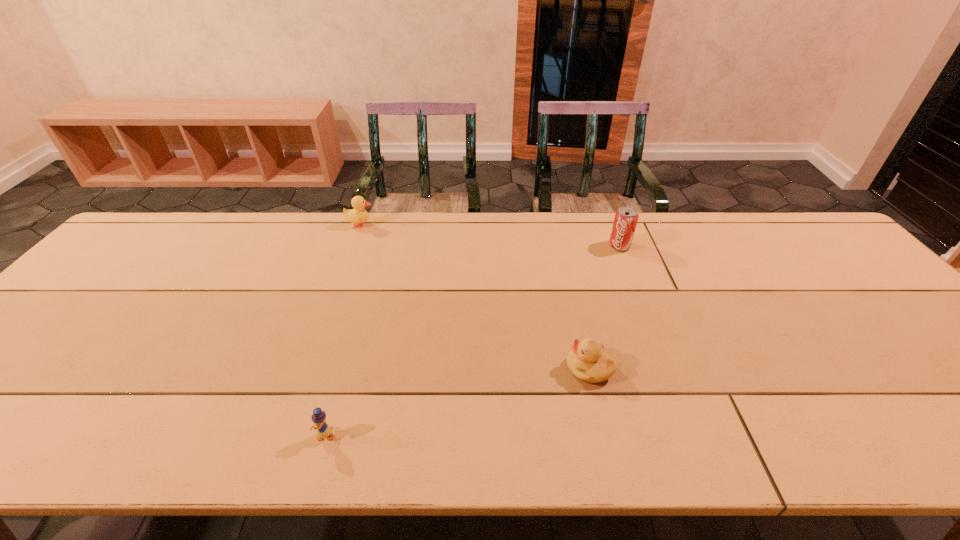
Locate an element on the screen. Image resolution: width=960 pixels, height=540 pixels. free region at the far left corner is located at coordinates (135, 238).

Locate an element on the screen. This screenshot has width=960, height=540. free space that is in between the second farthest object and the nearest object is located at coordinates (472, 341).

The image size is (960, 540). In order to click on vacant area that lies between the farthest duckling and the second nearest duckling in this screenshot , I will do 475,297.

In order to click on vacant area between the farthest duckling and the third nearest object in this screenshot , I will do `click(491, 235)`.

Where is `free space between the third farthest object and the rightmost object`? This screenshot has width=960, height=540. free space between the third farthest object and the rightmost object is located at coordinates (605, 307).

Locate an element on the screen. This screenshot has width=960, height=540. vacant space that is in between the third object from right to left and the rightmost duckling is located at coordinates (457, 402).

This screenshot has height=540, width=960. I want to click on blank region between the second duckling from left to right and the rightmost object, so click(x=472, y=341).

Locate an element on the screen. The width and height of the screenshot is (960, 540). vacant point located between the nearest object and the soda can is located at coordinates (472, 341).

This screenshot has height=540, width=960. Find the location of `vacant space in between the second farthest object and the second farthest duckling`. vacant space in between the second farthest object and the second farthest duckling is located at coordinates (605, 307).

I want to click on empty space that is in between the soda can and the second object from left to right, so click(472, 341).